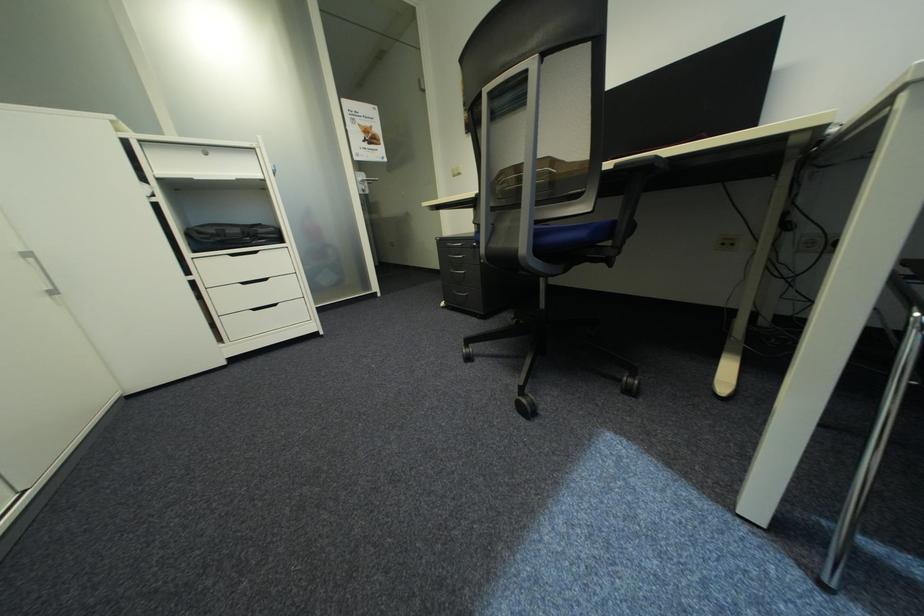
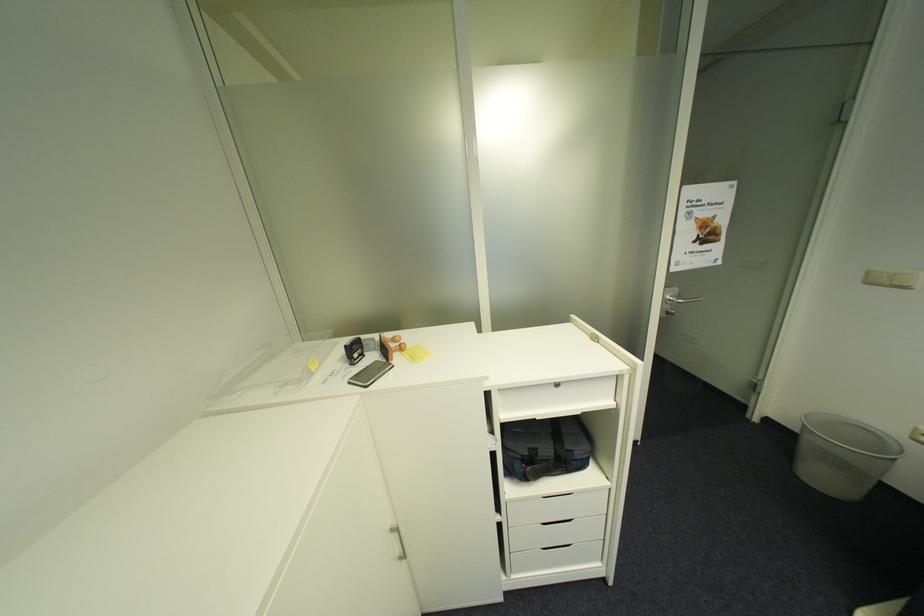
Where in the second image is the point corresponding to (x=465, y=175) from the first image?

(895, 285)